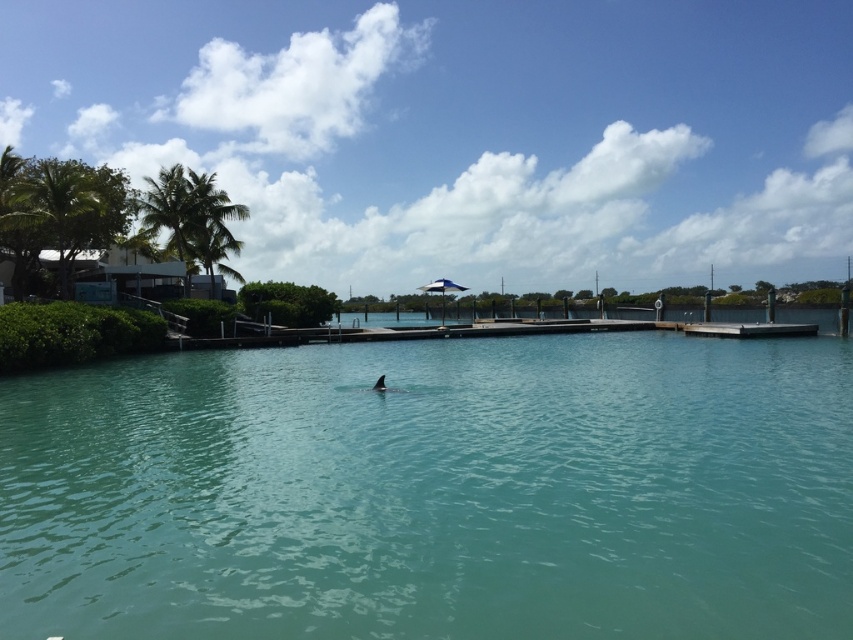
Does clear blue water at center have a greater width compared to green leafy palm tree at left?

Correct, the width of clear blue water at center exceeds that of green leafy palm tree at left.

Is clear blue water at center to the left of green leafy palm tree at left from the viewer's perspective?

No, clear blue water at center is not to the left of green leafy palm tree at left.

Find the location of a particular element. The width and height of the screenshot is (853, 640). clear blue water at center is located at coordinates (434, 492).

Which is below, green leafy palm tree at upper left or green leafy palm tree at left?

green leafy palm tree at left

Can you confirm if green leafy palm tree at upper left is shorter than green leafy palm tree at left?

In fact, green leafy palm tree at upper left may be taller than green leafy palm tree at left.

Who is more forward, (212, 285) or (47, 220)?

Point (47, 220) is in front.

The image size is (853, 640). Find the location of `green leafy palm tree at upper left`. green leafy palm tree at upper left is located at coordinates (192, 220).

Is clear blue water at center shorter than green leafy palm tree at upper left?

Correct, clear blue water at center is not as tall as green leafy palm tree at upper left.

Is point (824, 416) closer to camera compared to point (166, 196)?

That is True.

Locate an element on the screen. The width and height of the screenshot is (853, 640). clear blue water at center is located at coordinates (434, 492).